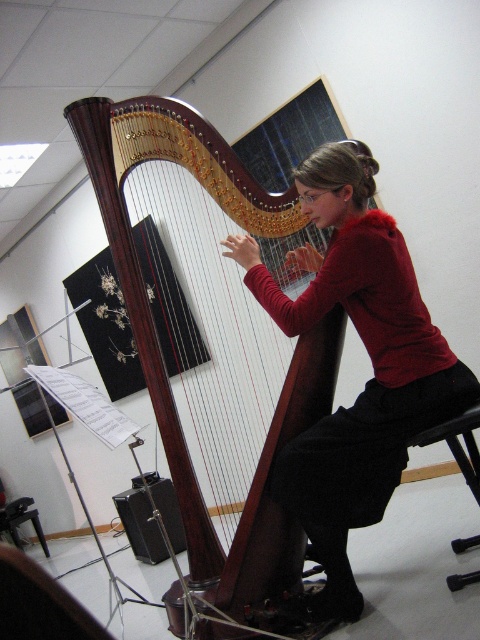
Is wooden harp at center to the left of black plastic stool at lower right from the viewer's perspective?

Indeed, wooden harp at center is positioned on the left side of black plastic stool at lower right.

This screenshot has width=480, height=640. Identify the location of wooden harp at center. (211, 340).

Between matte red sweater at center and black plastic stool at lower right, which one appears on the left side from the viewer's perspective?

matte red sweater at center

Which is behind, point (376, 474) or point (421, 442)?

Positioned behind is point (376, 474).

The height and width of the screenshot is (640, 480). I want to click on matte red sweater at center, so click(371, 360).

Is matte red sweater at center wider than black leather chair at lower center?

Indeed, matte red sweater at center has a greater width compared to black leather chair at lower center.

Which is below, matte red sweater at center or black leather chair at lower center?

Positioned lower is black leather chair at lower center.

The height and width of the screenshot is (640, 480). Identify the location of matte red sweater at center. (371, 360).

Image resolution: width=480 pixels, height=640 pixels. I want to click on matte red sweater at center, so click(x=371, y=360).